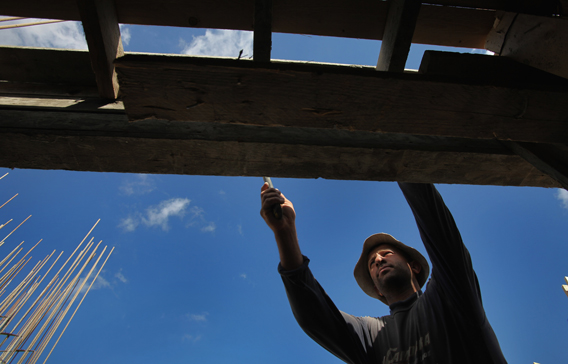
This screenshot has width=568, height=364. In order to click on wooden beams in this screenshot , I will do `click(105, 33)`, `click(265, 39)`, `click(396, 47)`.